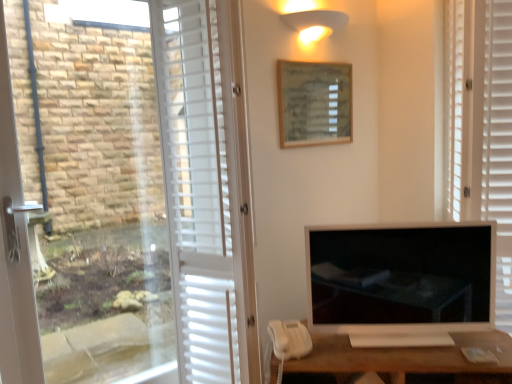
Question: From a real-world perspective, is white matte blind at right positioned over white matte corded phone at lower center based on gravity?

Choices:
 (A) yes
 (B) no

Answer: (A)

Question: From a real-world perspective, is white matte blind at right physically below white matte corded phone at lower center?

Choices:
 (A) yes
 (B) no

Answer: (B)

Question: Is white matte blind at right to the right of white matte corded phone at lower center from the viewer's perspective?

Choices:
 (A) yes
 (B) no

Answer: (A)

Question: Is white matte blind at right with white matte corded phone at lower center?

Choices:
 (A) no
 (B) yes

Answer: (A)

Question: Is white matte blind at right positioned beyond the bounds of white matte corded phone at lower center?

Choices:
 (A) yes
 (B) no

Answer: (A)

Question: From the image's perspective, is warm matte wall sconce at upper center above or below white matte screen door at left?

Choices:
 (A) above
 (B) below

Answer: (A)

Question: Is warm matte wall sconce at upper center spatially inside white matte screen door at left, or outside of it?

Choices:
 (A) inside
 (B) outside

Answer: (B)

Question: Does point (311, 9) appear closer or farther from the camera than point (216, 299)?

Choices:
 (A) closer
 (B) farther

Answer: (B)

Question: Would you say warm matte wall sconce at upper center is to the left or to the right of white matte screen door at left in the picture?

Choices:
 (A) right
 (B) left

Answer: (A)

Question: Considering the relative positions of warm matte wall sconce at upper center and white matte blind at right in the image provided, is warm matte wall sconce at upper center to the left or to the right of white matte blind at right?

Choices:
 (A) left
 (B) right

Answer: (A)

Question: Looking at their shapes, would you say warm matte wall sconce at upper center is wider or thinner than white matte blind at right?

Choices:
 (A) thin
 (B) wide

Answer: (A)

Question: From a real-world perspective, is warm matte wall sconce at upper center physically located above or below white matte blind at right?

Choices:
 (A) above
 (B) below

Answer: (A)

Question: In the image, is warm matte wall sconce at upper center positioned in front of or behind white matte blind at right?

Choices:
 (A) behind
 (B) front

Answer: (A)

Question: Do you think white matte desk at lower right is within white matte blind at right, or outside of it?

Choices:
 (A) outside
 (B) inside

Answer: (A)

Question: From the image's perspective, relative to white matte blind at right, is white matte desk at lower right above or below?

Choices:
 (A) above
 (B) below

Answer: (B)